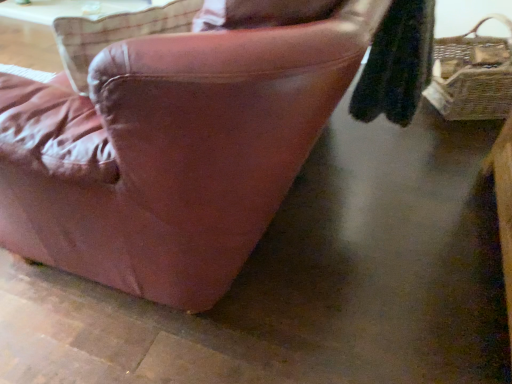
Image resolution: width=512 pixels, height=384 pixels. Describe the element at coordinates (472, 75) in the screenshot. I see `natural wicker picnic basket at right` at that location.

Where is `natural wicker picnic basket at right`? This screenshot has height=384, width=512. natural wicker picnic basket at right is located at coordinates (472, 75).

Locate an element on the screen. This screenshot has height=384, width=512. leather couch at center is located at coordinates (185, 155).

Describe the element at coordinates (185, 155) in the screenshot. The width and height of the screenshot is (512, 384). I see `leather couch at center` at that location.

The height and width of the screenshot is (384, 512). I want to click on natural wicker picnic basket at right, so click(x=472, y=75).

Visually, is natural wicker picnic basket at right positioned to the left or to the right of leather couch at center?

Clearly, natural wicker picnic basket at right is on the right of leather couch at center in the image.

Which object is further away from the camera, natural wicker picnic basket at right or leather couch at center?

Positioned behind is natural wicker picnic basket at right.

Is point (434, 85) closer or farther from the camera than point (96, 261)?

Point (434, 85).

From the image's perspective, is natural wicker picnic basket at right above or below leather couch at center?

Based on their image positions, natural wicker picnic basket at right is located above leather couch at center.

From a real-world perspective, is natural wicker picnic basket at right over leather couch at center?

Yes, from a real-world perspective, natural wicker picnic basket at right is over leather couch at center

Consider the image. Between natural wicker picnic basket at right and leather couch at center, which one has larger width?

leather couch at center is wider.

Considering the sizes of objects natural wicker picnic basket at right and leather couch at center in the image provided, who is shorter, natural wicker picnic basket at right or leather couch at center?

leather couch at center is shorter.

Which of these two, natural wicker picnic basket at right or leather couch at center, is bigger?

Bigger between the two is leather couch at center.

Is leather couch at center completely or partially inside natural wicker picnic basket at right?

Actually, leather couch at center is outside natural wicker picnic basket at right.

Are natural wicker picnic basket at right and leather couch at center far apart?

Yes.

Is natural wicker picnic basket at right oriented towards leather couch at center?

Yes, natural wicker picnic basket at right is oriented towards leather couch at center.

At what (x,y) coordinates should I click in order to perform the action: click on chair beneath the natural wicker picnic basket at right (from a real-world perspective). Please return your answer as a coordinate pair (x, y). Looking at the image, I should click on (185, 155).

Can you confirm if leather couch at center is positioned to the right of natural wicker picnic basket at right?

In fact, leather couch at center is to the left of natural wicker picnic basket at right.

Is the depth of leather couch at center greater than that of natural wicker picnic basket at right?

That is False.

Considering the positions of point (104, 87) and point (494, 97), is point (104, 87) closer or farther from the camera than point (494, 97)?

Point (104, 87) is positioned closer to the camera compared to point (494, 97).

From the image's perspective, is leather couch at center on top of natural wicker picnic basket at right?

No, from the image's perspective, leather couch at center is not above natural wicker picnic basket at right.

From a real-world perspective, who is located lower, leather couch at center or natural wicker picnic basket at right?

In real-world perspective, leather couch at center is lower.

Considering the sizes of objects leather couch at center and natural wicker picnic basket at right in the image provided, who is thinner, leather couch at center or natural wicker picnic basket at right?

With smaller width is natural wicker picnic basket at right.

Considering the sizes of objects leather couch at center and natural wicker picnic basket at right in the image provided, who is taller, leather couch at center or natural wicker picnic basket at right?

natural wicker picnic basket at right.

Considering the sizes of objects leather couch at center and natural wicker picnic basket at right in the image provided, who is bigger, leather couch at center or natural wicker picnic basket at right?

leather couch at center.

Is leather couch at center spatially inside natural wicker picnic basket at right, or outside of it?

leather couch at center is not enclosed by natural wicker picnic basket at right.

Is leather couch at center placed right next to natural wicker picnic basket at right?

No, leather couch at center is not beside natural wicker picnic basket at right.

Is leather couch at center facing away from natural wicker picnic basket at right?

No, leather couch at center is not facing away from natural wicker picnic basket at right.

How far apart are leather couch at center and natural wicker picnic basket at right?

1.70 meters.

Find the location of a particular element. The image size is (512, 384). picnic basket behind the leather couch at center is located at coordinates (472, 75).

This screenshot has width=512, height=384. In order to click on picnic basket above the leather couch at center (from a real-world perspective) in this screenshot , I will do `click(472, 75)`.

Where is `chair below the natural wicker picnic basket at right (from a real-world perspective)`? This screenshot has width=512, height=384. chair below the natural wicker picnic basket at right (from a real-world perspective) is located at coordinates (185, 155).